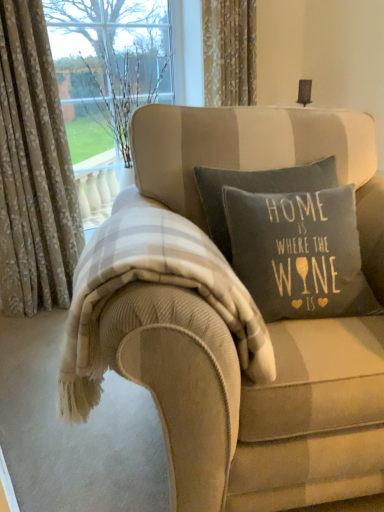
Question: Does dark gray cotton pillow at center appear on the left side of plaid wool blanket at center?

Choices:
 (A) yes
 (B) no

Answer: (B)

Question: Could you tell me if dark gray cotton pillow at center is turned towards plaid wool blanket at center?

Choices:
 (A) yes
 (B) no

Answer: (B)

Question: From the image's perspective, is dark gray cotton pillow at center located above plaid wool blanket at center?

Choices:
 (A) no
 (B) yes

Answer: (B)

Question: Is dark gray cotton pillow at center positioned before plaid wool blanket at center?

Choices:
 (A) no
 (B) yes

Answer: (A)

Question: Is dark gray cotton pillow at center shorter than plaid wool blanket at center?

Choices:
 (A) yes
 (B) no

Answer: (B)

Question: Is plaid wool blanket at center situated inside floral-patterned fabric at left, the second curtain from the right, or outside?

Choices:
 (A) outside
 (B) inside

Answer: (A)

Question: Looking at the image, does plaid wool blanket at center seem bigger or smaller compared to floral-patterned fabric at left, the second curtain from the right?

Choices:
 (A) small
 (B) big

Answer: (A)

Question: From a real-world perspective, is plaid wool blanket at center positioned above or below floral-patterned fabric at left, arranged as the first curtain when viewed from the left?

Choices:
 (A) below
 (B) above

Answer: (A)

Question: Considering the positions of plaid wool blanket at center and floral-patterned fabric at left, arranged as the first curtain when viewed from the left, in the image, is plaid wool blanket at center taller or shorter than floral-patterned fabric at left, arranged as the first curtain when viewed from the left,?

Choices:
 (A) tall
 (B) short

Answer: (B)

Question: Is dark gray cotton pillow at center situated inside floral-patterned fabric at left, the second curtain from the right, or outside?

Choices:
 (A) inside
 (B) outside

Answer: (B)

Question: From a real-world perspective, is dark gray cotton pillow at center physically located above or below floral-patterned fabric at left, arranged as the first curtain when viewed from the left?

Choices:
 (A) below
 (B) above

Answer: (A)

Question: Visually, is dark gray cotton pillow at center positioned to the left or to the right of floral-patterned fabric at left, arranged as the first curtain when viewed from the left?

Choices:
 (A) left
 (B) right

Answer: (B)

Question: Based on their sizes in the image, would you say dark gray cotton pillow at center is bigger or smaller than floral-patterned fabric at left, the second curtain from the right?

Choices:
 (A) big
 (B) small

Answer: (B)

Question: In terms of size, does beige corduroy couch at center appear bigger or smaller than dark gray cotton pillow at center?

Choices:
 (A) small
 (B) big

Answer: (B)

Question: Is beige corduroy couch at center wider or thinner than dark gray cotton pillow at center?

Choices:
 (A) thin
 (B) wide

Answer: (B)